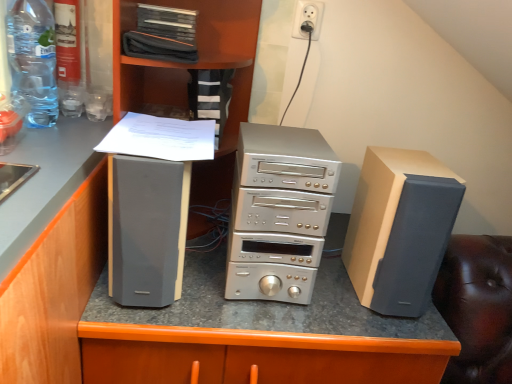
Find the location of a particular element. Image resolution: width=512 pixels, height=384 pixels. free location to the left of matte beige computer tower at right is located at coordinates (330, 290).